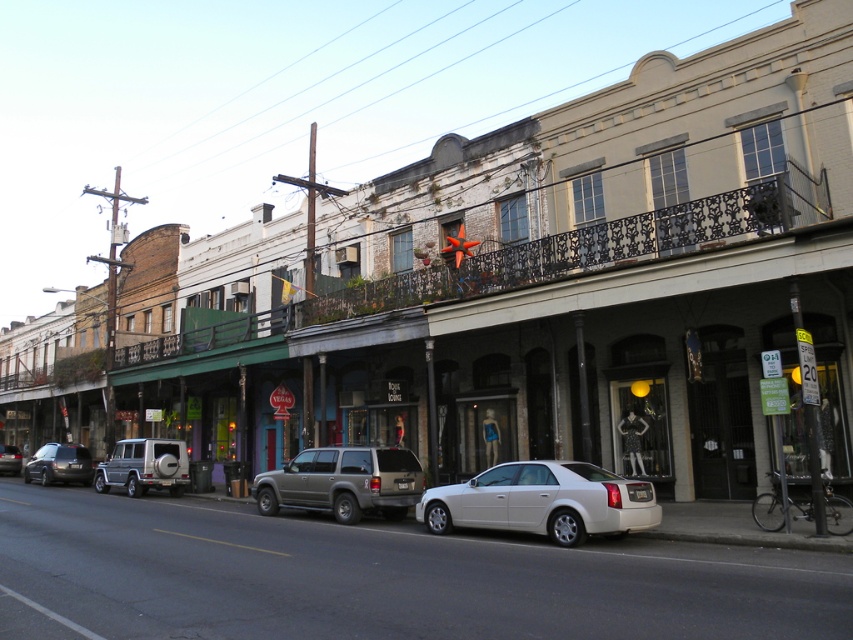
Is white glossy sedan at center positioned behind silver metallic suv at center?

That is False.

Does point (646, 492) come behind point (9, 454)?

No, it is in front of (9, 454).

Does point (627, 490) lie behind point (9, 461)?

No.

Where is `white glossy sedan at center`? The width and height of the screenshot is (853, 640). white glossy sedan at center is located at coordinates (543, 500).

Between matte gold suv at center and silver metallic suv at center, which one appears on the left side from the viewer's perspective?

silver metallic suv at center is more to the left.

Measure the distance between matte gold suv at center and silver metallic suv at center.

A distance of 86.45 feet exists between matte gold suv at center and silver metallic suv at center.

Who is more forward, [270,493] or [0,460]?

Positioned in front is point [270,493].

Locate an element on the screen. matte gold suv at center is located at coordinates (343, 483).

Describe the element at coordinates (343, 483) in the screenshot. This screenshot has width=853, height=640. I see `matte gold suv at center` at that location.

Can you confirm if matte gold suv at center is thinner than matte black suv at left?

Yes.

Does point (340, 500) come in front of point (65, 460)?

Yes, it is.

Locate an element on the screen. This screenshot has width=853, height=640. matte gold suv at center is located at coordinates (343, 483).